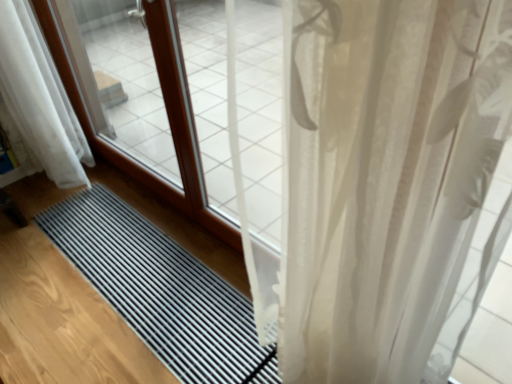
Find the location of a particular element. This screenshot has width=512, height=384. empty space that is ontop of black rubber mat at center (from a real-world perspective) is located at coordinates tap(175, 303).